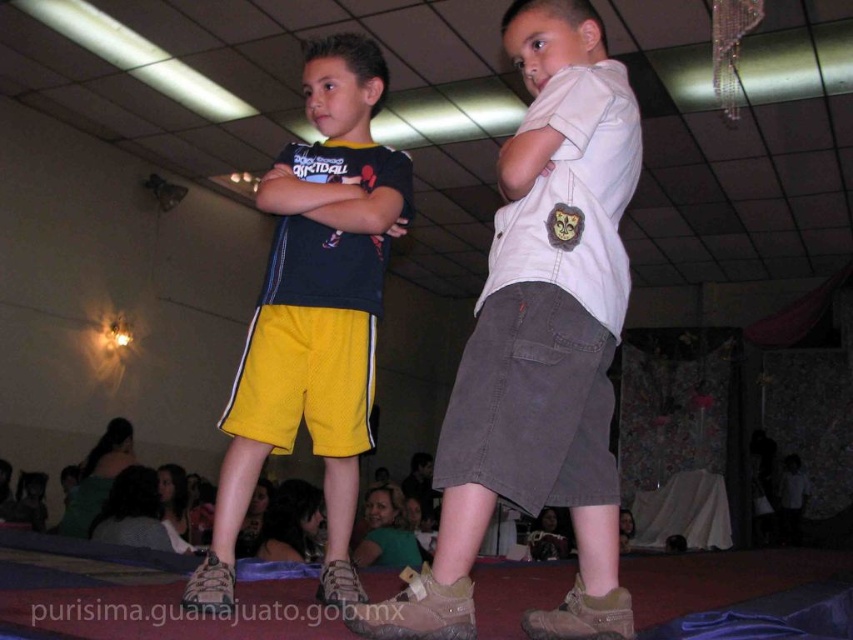
Question: Does matte yellow shorts at center have a smaller size compared to white matte shirt at upper center?

Choices:
 (A) yes
 (B) no

Answer: (B)

Question: Which object is closer to the camera taking this photo?

Choices:
 (A) matte black shirt at center
 (B) matte yellow shorts at center

Answer: (B)

Question: Can you confirm if matte yellow shorts at center is thinner than matte black shirt at center?

Choices:
 (A) no
 (B) yes

Answer: (A)

Question: Does yellow mesh shorts at left appear on the right side of white matte shirt at upper center?

Choices:
 (A) no
 (B) yes

Answer: (A)

Question: Among these objects, which one is nearest to the camera?

Choices:
 (A) white matte shirt at upper center
 (B) matte black shirt at center
 (C) matte yellow shorts at center

Answer: (C)

Question: Which point is closer to the camera taking this photo?

Choices:
 (A) (325, 275)
 (B) (576, 150)

Answer: (B)